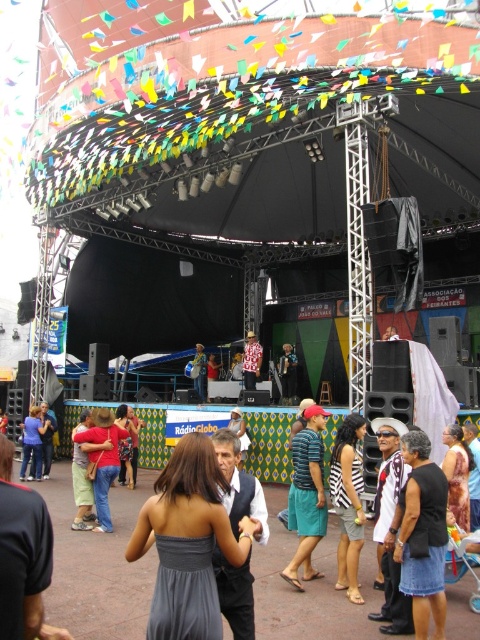
Question: Which of the following is the closest to the observer?

Choices:
 (A) tap(251, 372)
 (B) tap(76, 426)

Answer: (B)

Question: Is brown textured dress at lower right positioned at the back of green fabric dress at center?

Choices:
 (A) yes
 (B) no

Answer: (B)

Question: Considering the real-world distances, which object is closest to the red and white striped shirt at center?

Choices:
 (A) brown textured dress at lower right
 (B) matte black shirt at center
 (C) striped fabric shirt at center

Answer: (B)

Question: Is brown textured dress at lower right to the left of red and white striped shirt at center from the viewer's perspective?

Choices:
 (A) yes
 (B) no

Answer: (B)

Question: Is white printed shirt at center smaller than striped fabric shirt at center?

Choices:
 (A) yes
 (B) no

Answer: (A)

Question: Which is farther from the dark gray fabric dress at center?

Choices:
 (A) matte black shirt at center
 (B) shiny silver accordion at center
 (C) white printed shirt at center

Answer: (A)